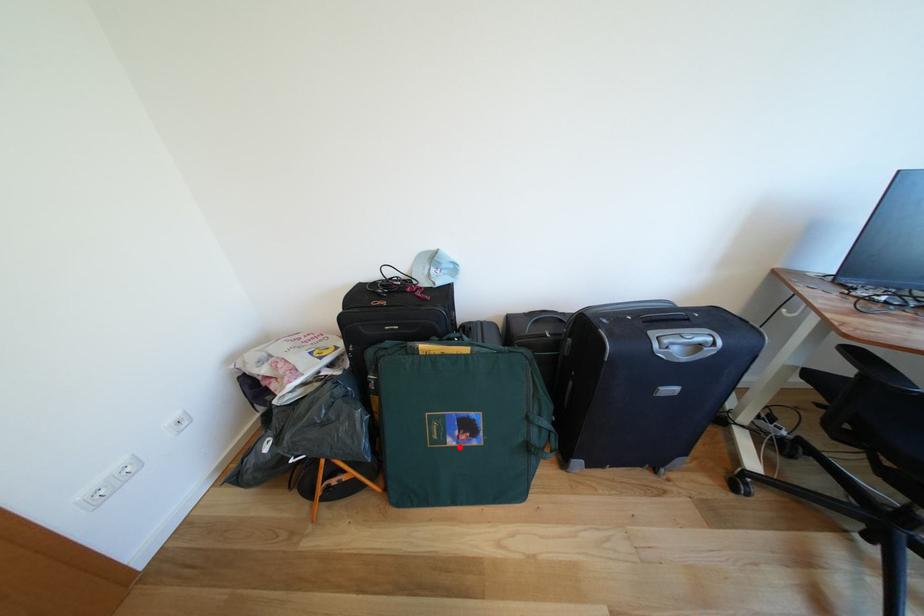
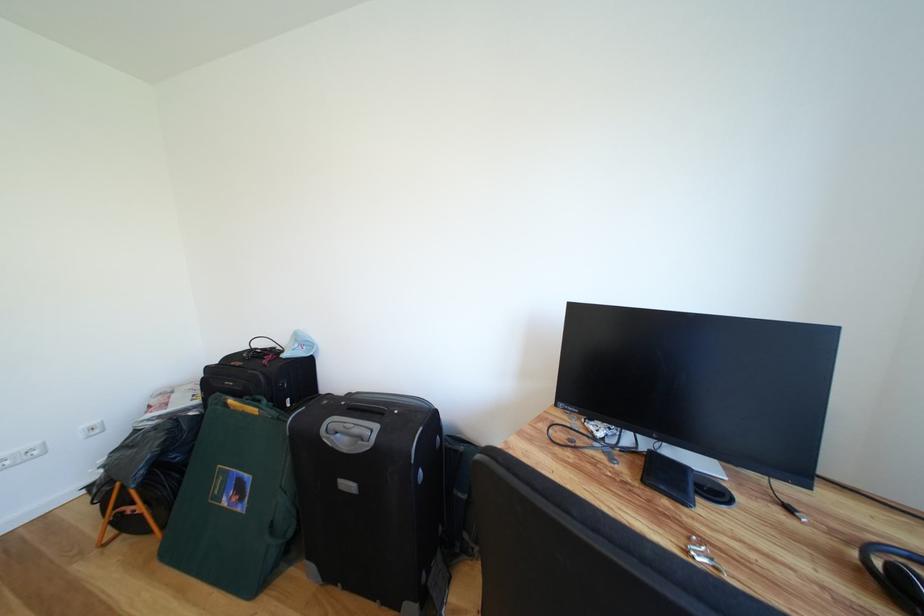
Locate, in the second image, the point that corresponds to the highlighted location in the first image.

(234, 506)